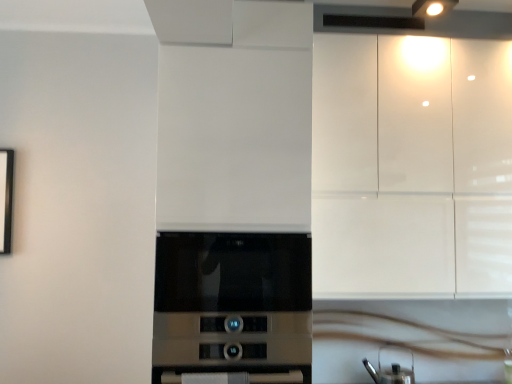
What do you see at coordinates (464, 382) in the screenshot? I see `white glossy countertop at lower center` at bounding box center [464, 382].

You are a GUI agent. You are given a task and a screenshot of the screen. Output one action in this format:
    pyautogui.click(x=<x>, y=<y>)
    Task: Click on the glossy white cabinets at upper right
    
    Given the screenshot: What is the action you would take?
    pyautogui.click(x=411, y=167)

This screenshot has height=384, width=512. In order to click on satin silver microwave at center in this screenshot , I will do `click(233, 306)`.

The height and width of the screenshot is (384, 512). Identify the location of white glossy countertop at lower center. (464, 382).

Which object is positioned more to the right, metallic silver kettle at lower right or white glossy countertop at lower center?

Positioned to the right is white glossy countertop at lower center.

From the image's perspective, which one is positioned lower, metallic silver kettle at lower right or white glossy countertop at lower center?

white glossy countertop at lower center.

Between metallic silver kettle at lower right and white glossy countertop at lower center, which one has larger size?

metallic silver kettle at lower right.

Consider the image. Is glossy white cabinets at upper right wider or thinner than satin silver microwave at center?

Considering their sizes, glossy white cabinets at upper right looks slimmer than satin silver microwave at center.

Is glossy white cabinets at upper right facing towards satin silver microwave at center?

No.

Is glossy white cabinets at upper right positioned in front of satin silver microwave at center?

No, the depth of glossy white cabinets at upper right is greater than that of satin silver microwave at center.

Consider the image. Who is shorter, metallic silver kettle at lower right or glossy white cabinets at upper right?

metallic silver kettle at lower right is shorter.

Is metallic silver kettle at lower right far away from glossy white cabinets at upper right?

No, metallic silver kettle at lower right is not far away from glossy white cabinets at upper right.

From the picture: Is metallic silver kettle at lower right positioned with its back to glossy white cabinets at upper right?

No, metallic silver kettle at lower right is not facing the opposite direction of glossy white cabinets at upper right.

From the image's perspective, which one is positioned lower, metallic silver kettle at lower right or glossy white cabinets at upper right?

metallic silver kettle at lower right appears lower in the image.

Is glossy white cabinets at upper right at the right side of metallic silver kettle at lower right?

Indeed, glossy white cabinets at upper right is positioned on the right side of metallic silver kettle at lower right.

Considering the sizes of objects glossy white cabinets at upper right and metallic silver kettle at lower right in the image provided, who is thinner, glossy white cabinets at upper right or metallic silver kettle at lower right?

Thinner between the two is metallic silver kettle at lower right.

Which of these two, glossy white cabinets at upper right or metallic silver kettle at lower right, stands taller?

Standing taller between the two is glossy white cabinets at upper right.

Considering the relative positions of glossy white cabinets at upper right and metallic silver kettle at lower right in the image provided, is glossy white cabinets at upper right in front of metallic silver kettle at lower right?

Yes, it is.

Where is `cabinetry in front of the white glossy countertop at lower center`? Image resolution: width=512 pixels, height=384 pixels. cabinetry in front of the white glossy countertop at lower center is located at coordinates (411, 167).

Considering the sizes of white glossy countertop at lower center and glossy white cabinets at upper right in the image, is white glossy countertop at lower center wider or thinner than glossy white cabinets at upper right?

Considering their sizes, white glossy countertop at lower center looks slimmer than glossy white cabinets at upper right.

How far apart are satin silver microwave at center and glossy white cabinets at upper right?

satin silver microwave at center is 24.28 inches from glossy white cabinets at upper right.

Is point (238, 308) positioned in front of point (496, 213)?

Yes, point (238, 308) is closer to viewer.

Considering the relative sizes of satin silver microwave at center and glossy white cabinets at upper right in the image provided, is satin silver microwave at center bigger than glossy white cabinets at upper right?

Actually, satin silver microwave at center might be smaller than glossy white cabinets at upper right.

In order to click on counter top behind the glossy white cabinets at upper right in this screenshot , I will do `click(464, 382)`.

Is glossy white cabinets at upper right facing towards white glossy countertop at lower center?

No, glossy white cabinets at upper right is not turned towards white glossy countertop at lower center.

Is point (453, 277) farther from viewer compared to point (329, 383)?

That is False.

The image size is (512, 384). Find the location of `counter top behind the metallic silver kettle at lower right`. counter top behind the metallic silver kettle at lower right is located at coordinates (464, 382).

What are the coordinates of `home appliance below the glossy white cabinets at upper right (from the image's perspective)` in the screenshot? It's located at (233, 306).

Considering their positions, is satin silver microwave at center positioned closer to glossy white cabinets at upper right than metallic silver kettle at lower right?

satin silver microwave at center is closer to glossy white cabinets at upper right.

Based on their spatial positions, is glossy white cabinets at upper right or metallic silver kettle at lower right further from white glossy countertop at lower center?

Among the two, glossy white cabinets at upper right is located further to white glossy countertop at lower center.

Estimate the real-world distances between objects in this image. Which object is further from satin silver microwave at center, glossy white cabinets at upper right or white glossy countertop at lower center?

white glossy countertop at lower center lies further to satin silver microwave at center than the other object.

Which object lies further to the anchor point glossy white cabinets at upper right, white glossy countertop at lower center or satin silver microwave at center?

Based on the image, white glossy countertop at lower center appears to be further to glossy white cabinets at upper right.

Estimate the real-world distances between objects in this image. Which object is further from white glossy countertop at lower center, satin silver microwave at center or metallic silver kettle at lower right?

satin silver microwave at center lies further to white glossy countertop at lower center than the other object.

Looking at the image, which one is located further to glossy white cabinets at upper right, white glossy countertop at lower center or metallic silver kettle at lower right?

white glossy countertop at lower center is further to glossy white cabinets at upper right.

Which object lies further to the anchor point metallic silver kettle at lower right, satin silver microwave at center or glossy white cabinets at upper right?

The object further to metallic silver kettle at lower right is satin silver microwave at center.

From the image, which object appears to be nearer to white glossy countertop at lower center, metallic silver kettle at lower right or glossy white cabinets at upper right?

The object closer to white glossy countertop at lower center is metallic silver kettle at lower right.

Where is `home appliance that lies between glossy white cabinets at upper right and metallic silver kettle at lower right from top to bottom`? The height and width of the screenshot is (384, 512). home appliance that lies between glossy white cabinets at upper right and metallic silver kettle at lower right from top to bottom is located at coordinates (233, 306).

This screenshot has height=384, width=512. Find the location of `appliance between glossy white cabinets at upper right and white glossy countertop at lower center from top to bottom`. appliance between glossy white cabinets at upper right and white glossy countertop at lower center from top to bottom is located at coordinates (391, 368).

Locate an element on the screen. home appliance between glossy white cabinets at upper right and white glossy countertop at lower center in the up-down direction is located at coordinates (233, 306).

You are a GUI agent. You are given a task and a screenshot of the screen. Output one action in this format:
    pyautogui.click(x=<x>, y=<y>)
    Task: Click on the appliance between satin silver microwave at center and white glossy countertop at lower center in the horizontal direction
    
    Given the screenshot: What is the action you would take?
    pyautogui.click(x=391, y=368)